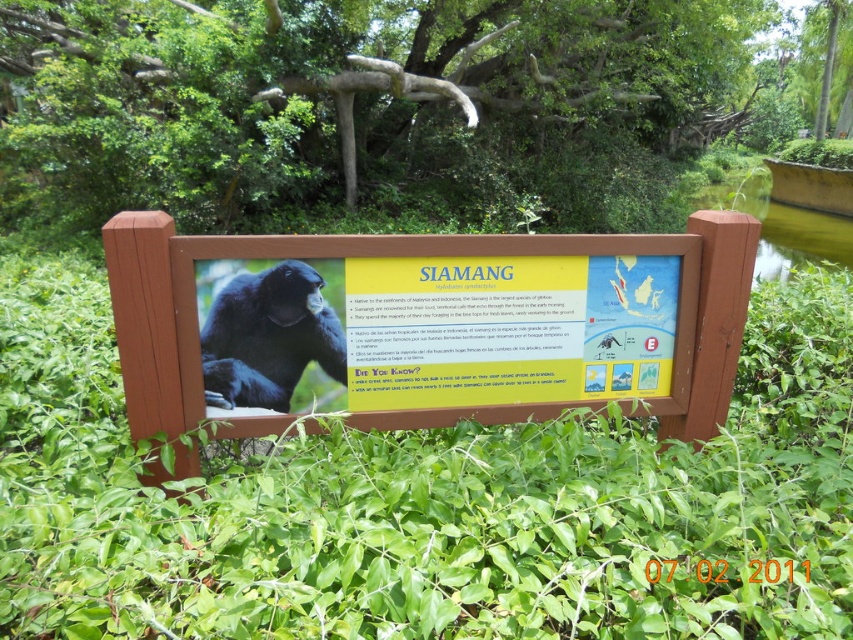
You are a visitor at the zoo and want to take a photo of the shiny black siamang at center without the green leafy plant at center blocking the view. Is the plant taller than the siamang?

The green leafy plant at center has a greater height compared to the shiny black siamang at center, so the plant is taller and may block the view.

You are standing in front of the signboard and notice two points marked on it. The first point is at coordinates point (x=515, y=557) and the second is at point (x=523, y=352). Which point is closer to you?

Point (x=515, y=557) is in front of point (x=523, y=352), so the first point is closer to you.

You are standing at the entrance of the zoo and want to locate the wooden signboard at center. According to the coordinates provided, where should you look to find it?

The wooden signboard at center is located at point coordinates of (x=444, y=324).